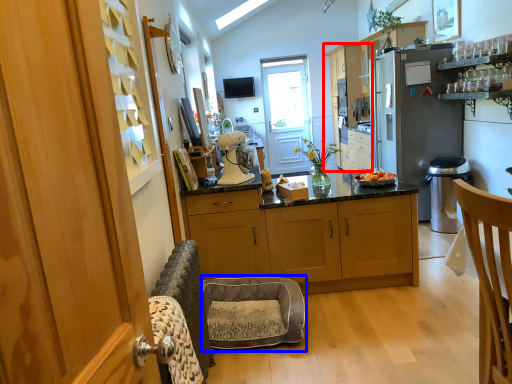
Question: Which object is further to the camera taking this photo, cabinetry (highlighted by a red box) or cat bed (highlighted by a blue box)?

Choices:
 (A) cabinetry
 (B) cat bed

Answer: (A)